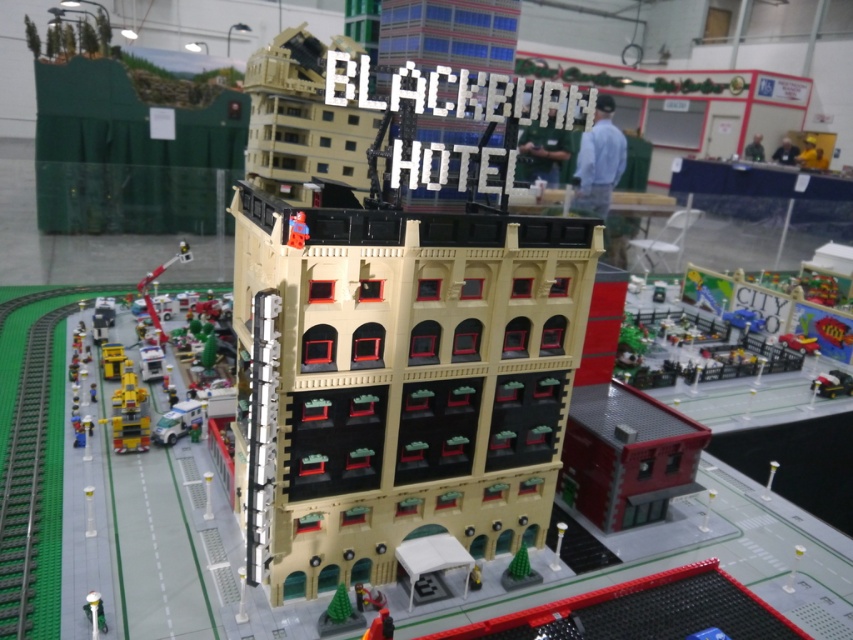
Is beige plastic building at center taller than yellow plastic toy car at lower left?

Indeed, beige plastic building at center has a greater height compared to yellow plastic toy car at lower left.

Is beige plastic building at center to the right of yellow plastic toy car at lower left from the viewer's perspective?

Yes, beige plastic building at center is to the right of yellow plastic toy car at lower left.

Is point (468, 284) less distant than point (122, 417)?

Yes, it is in front of point (122, 417).

Where is `beige plastic building at center`? beige plastic building at center is located at coordinates (404, 344).